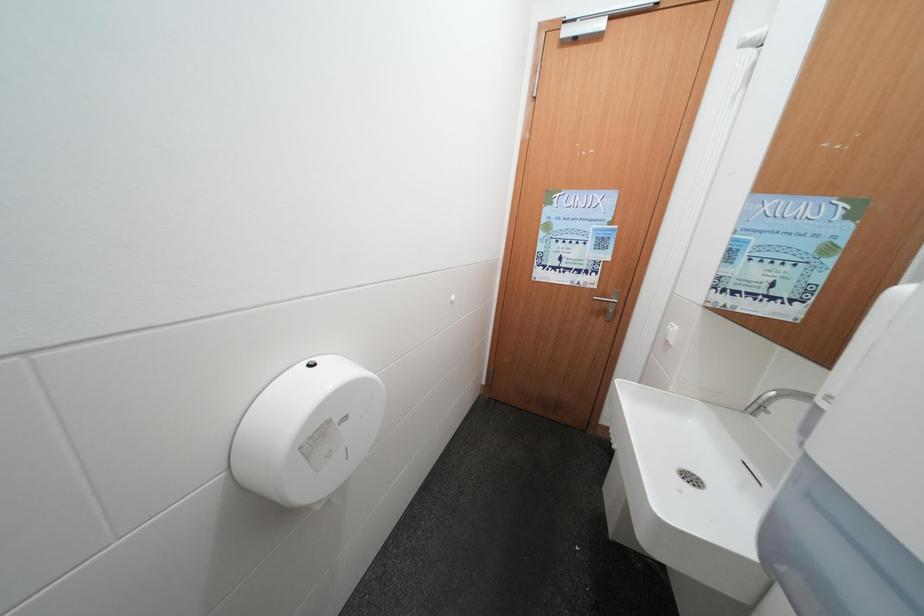
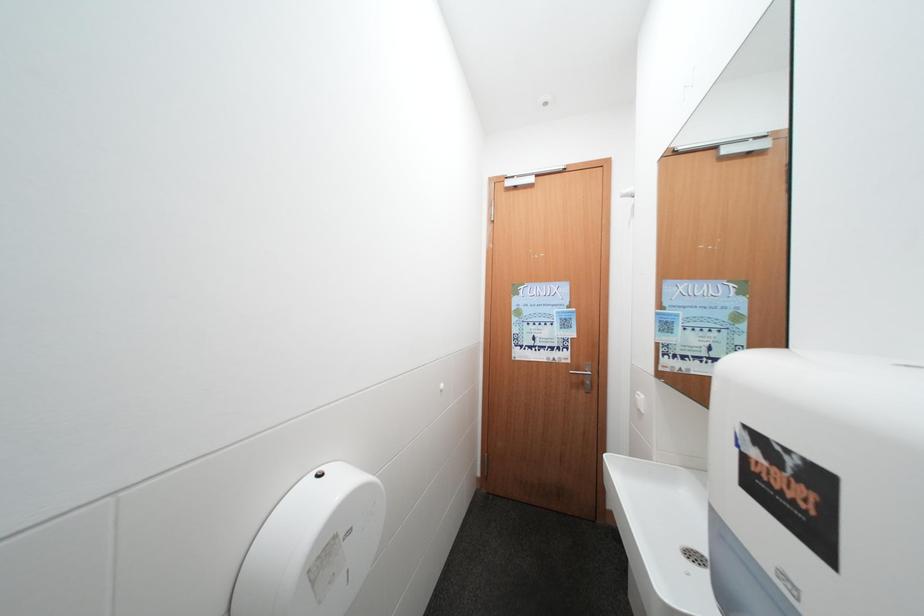
Question: The images are taken continuously from a first-person perspective. In which direction is your viewpoint rotating?

Choices:
 (A) Left
 (B) Right
 (C) Up
 (D) Down

Answer: (C)